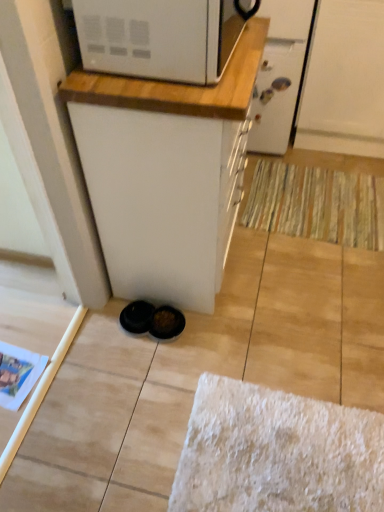
Question: Does white glossy screen door at upper center, positioned as the 1th screen door in left-to-right order, have a lesser height compared to white wood countertop at upper center?

Choices:
 (A) yes
 (B) no

Answer: (B)

Question: From the image's perspective, is white glossy screen door at upper center, which ranks as the second screen door in right-to-left order, located beneath white wood countertop at upper center?

Choices:
 (A) yes
 (B) no

Answer: (B)

Question: From a real-world perspective, is white glossy screen door at upper center, positioned as the 1th screen door in left-to-right order, physically below white wood countertop at upper center?

Choices:
 (A) yes
 (B) no

Answer: (A)

Question: Is white glossy screen door at upper center, positioned as the 1th screen door in left-to-right order, facing towards white wood countertop at upper center?

Choices:
 (A) yes
 (B) no

Answer: (A)

Question: Does white glossy screen door at upper center, positioned as the 1th screen door in left-to-right order, appear on the left side of white wood countertop at upper center?

Choices:
 (A) no
 (B) yes

Answer: (A)

Question: From the image's perspective, is white wood countertop at upper center located above or below white matte screen door at upper right, which is the 1th screen door from right to left?

Choices:
 (A) below
 (B) above

Answer: (A)

Question: From a real-world perspective, relative to white matte screen door at upper right, placed as the 2th screen door when sorted from left to right, is white wood countertop at upper center vertically above or below?

Choices:
 (A) below
 (B) above

Answer: (B)

Question: Looking at their shapes, would you say white wood countertop at upper center is wider or thinner than white matte screen door at upper right, which is the 1th screen door from right to left?

Choices:
 (A) thin
 (B) wide

Answer: (A)

Question: Is white wood countertop at upper center inside or outside of white matte screen door at upper right, placed as the 2th screen door when sorted from left to right?

Choices:
 (A) outside
 (B) inside

Answer: (A)

Question: Relative to white matte screen door at upper right, which is the 1th screen door from right to left, is striped fabric doormat at lower right in front or behind?

Choices:
 (A) front
 (B) behind

Answer: (B)

Question: Based on their positions, is striped fabric doormat at lower right located to the left or right of white matte screen door at upper right, which is the 1th screen door from right to left?

Choices:
 (A) left
 (B) right

Answer: (A)

Question: Considering the positions of striped fabric doormat at lower right and white matte screen door at upper right, placed as the 2th screen door when sorted from left to right, in the image, is striped fabric doormat at lower right wider or thinner than white matte screen door at upper right, placed as the 2th screen door when sorted from left to right,?

Choices:
 (A) wide
 (B) thin

Answer: (B)

Question: Is point (382, 248) closer or farther from the camera than point (317, 114)?

Choices:
 (A) farther
 (B) closer

Answer: (B)

Question: Does point (225, 74) appear closer or farther from the camera than point (276, 136)?

Choices:
 (A) farther
 (B) closer

Answer: (B)

Question: Considering the positions of white wood countertop at upper center and white glossy screen door at upper center, positioned as the 1th screen door in left-to-right order, in the image, is white wood countertop at upper center taller or shorter than white glossy screen door at upper center, positioned as the 1th screen door in left-to-right order,?

Choices:
 (A) short
 (B) tall

Answer: (A)